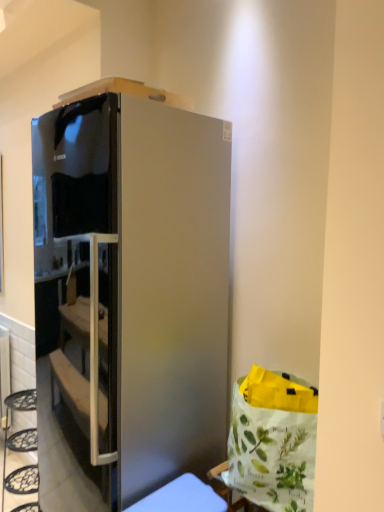
Question: In the image, is satin silver refrigerator at center positioned in front of or behind satin silver fridge at lower center?

Choices:
 (A) front
 (B) behind

Answer: (B)

Question: Is satin silver refrigerator at center taller or shorter than satin silver fridge at lower center?

Choices:
 (A) tall
 (B) short

Answer: (A)

Question: Considering the positions of point (125, 82) and point (130, 508), is point (125, 82) closer or farther from the camera than point (130, 508)?

Choices:
 (A) closer
 (B) farther

Answer: (A)

Question: Is satin silver fridge at lower center to the left or to the right of satin silver refrigerator at center in the image?

Choices:
 (A) left
 (B) right

Answer: (B)

Question: Is satin silver fridge at lower center wider or thinner than satin silver refrigerator at center?

Choices:
 (A) wide
 (B) thin

Answer: (B)

Question: From a real-world perspective, relative to satin silver refrigerator at center, is satin silver fridge at lower center vertically above or below?

Choices:
 (A) above
 (B) below

Answer: (B)

Question: In terms of height, does satin silver fridge at lower center look taller or shorter compared to satin silver refrigerator at center?

Choices:
 (A) short
 (B) tall

Answer: (A)